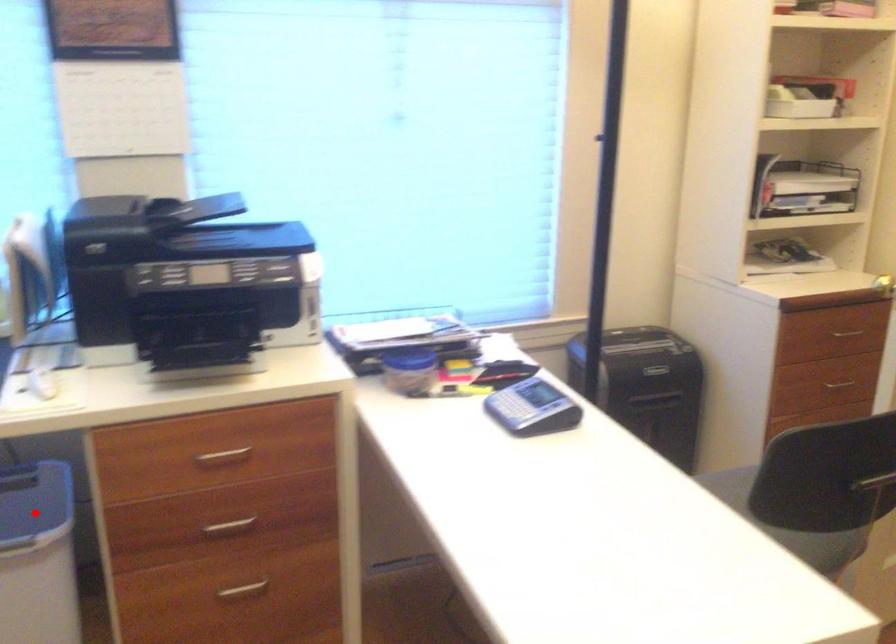
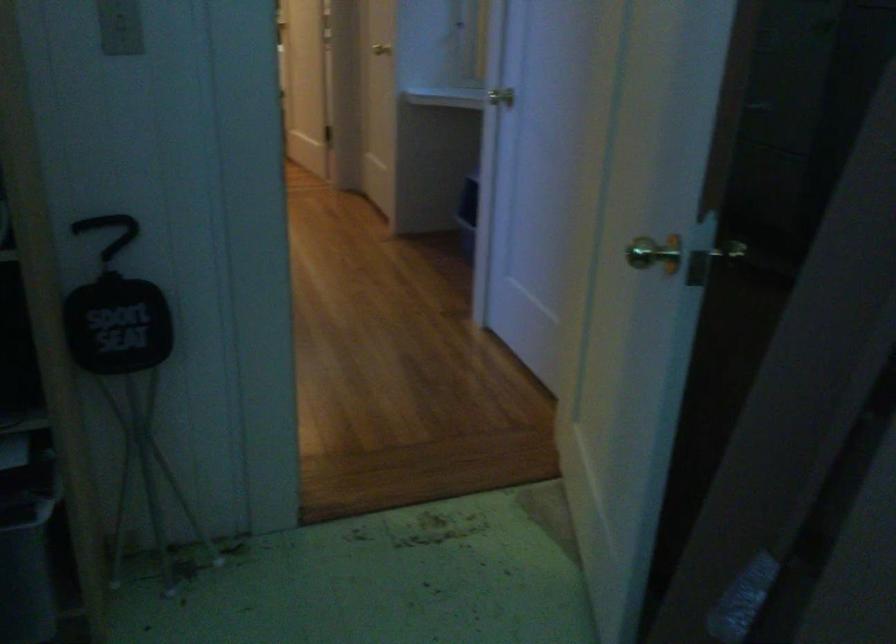
Question: I am providing you with two images of the same scene from different viewpoints. A red point is marked on the first image. Is the red point's position out of view in image 2?

Choices:
 (A) Yes
 (B) No

Answer: (A)